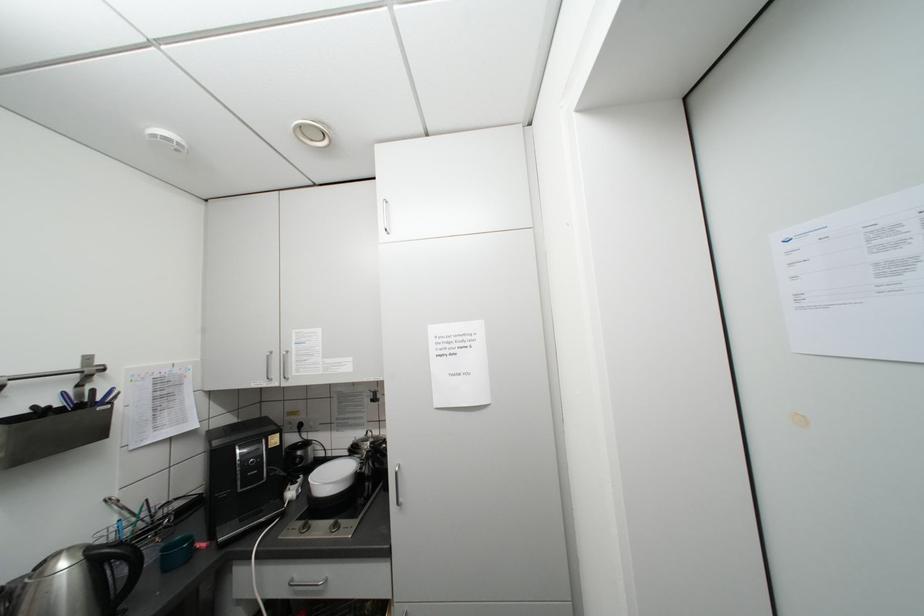
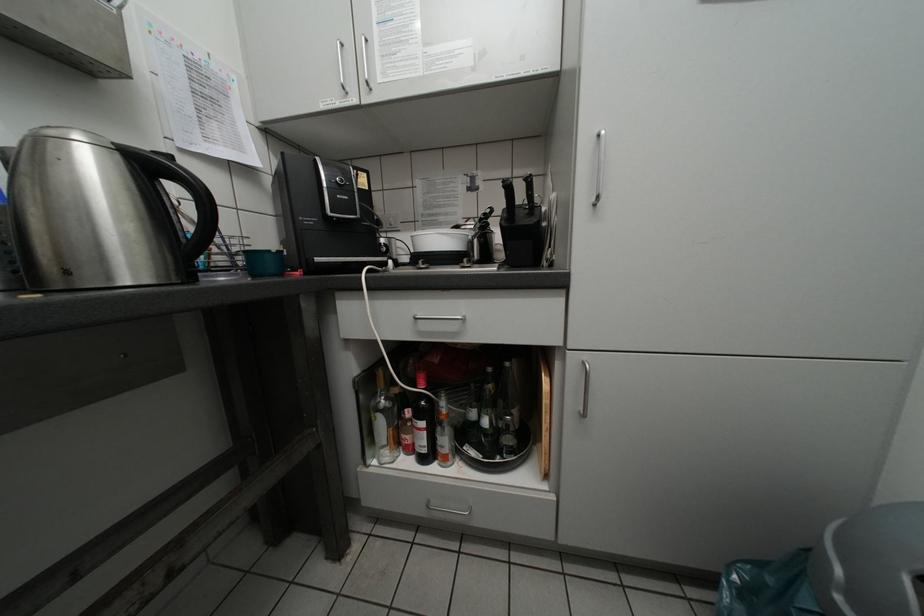
The images are taken continuously from a first-person perspective. In which direction are you moving?

The movement direction of the cameraman is left, forward.